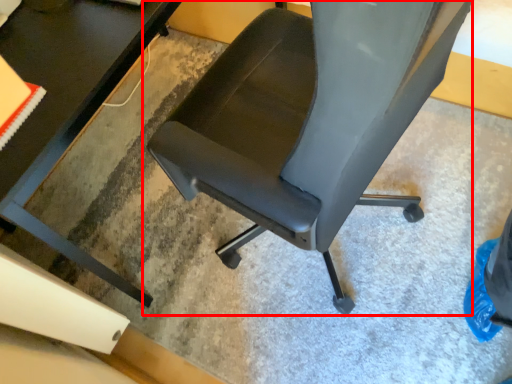
Question: From the image's perspective, considering the relative positions of chair (annotated by the red box) and table in the image provided, where is chair (annotated by the red box) located with respect to the staircase?

Choices:
 (A) below
 (B) above

Answer: (A)